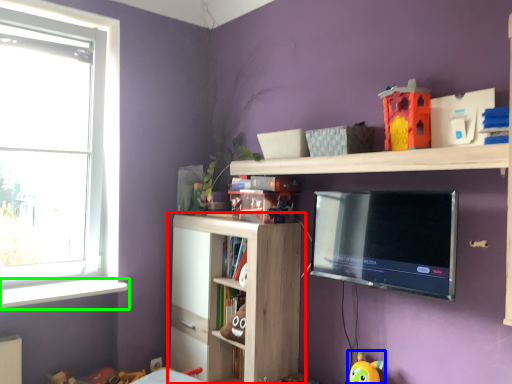
Question: Which object is positioned farthest from shelf (highlighted by a red box)? Select from toy (highlighted by a blue box) and window sill (highlighted by a green box).

Choices:
 (A) toy
 (B) window sill

Answer: (A)